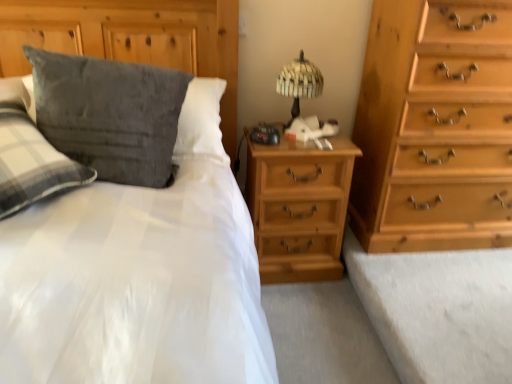
Question: Does suede-like gray pillow at upper left turn towards light brown wood nightstand at center?

Choices:
 (A) no
 (B) yes

Answer: (A)

Question: Is suede-like gray pillow at upper left turned away from light brown wood nightstand at center?

Choices:
 (A) yes
 (B) no

Answer: (B)

Question: Is suede-like gray pillow at upper left at the left side of light brown wood nightstand at center?

Choices:
 (A) yes
 (B) no

Answer: (A)

Question: Considering the relative sizes of suede-like gray pillow at upper left and light brown wood nightstand at center in the image provided, is suede-like gray pillow at upper left thinner than light brown wood nightstand at center?

Choices:
 (A) no
 (B) yes

Answer: (A)

Question: Is light brown wood nightstand at center inside suede-like gray pillow at upper left?

Choices:
 (A) yes
 (B) no

Answer: (B)

Question: Choose the correct answer: Is woven wood table lamp at upper center inside velvety gray pillow at upper left or outside it?

Choices:
 (A) inside
 (B) outside

Answer: (B)

Question: From the image's perspective, is woven wood table lamp at upper center positioned above or below velvety gray pillow at upper left?

Choices:
 (A) above
 (B) below

Answer: (A)

Question: Is woven wood table lamp at upper center in front of or behind velvety gray pillow at upper left in the image?

Choices:
 (A) front
 (B) behind

Answer: (B)

Question: From their relative heights in the image, would you say woven wood table lamp at upper center is taller or shorter than velvety gray pillow at upper left?

Choices:
 (A) tall
 (B) short

Answer: (B)

Question: Relative to light brown wood nightstand at center, is light brown wooden chest of drawers at right in front or behind?

Choices:
 (A) front
 (B) behind

Answer: (A)

Question: Would you say light brown wooden chest of drawers at right is to the left or to the right of light brown wood nightstand at center in the picture?

Choices:
 (A) right
 (B) left

Answer: (A)

Question: From a real-world perspective, is light brown wooden chest of drawers at right above or below light brown wood nightstand at center?

Choices:
 (A) below
 (B) above

Answer: (B)

Question: Is light brown wooden chest of drawers at right spatially inside light brown wood nightstand at center, or outside of it?

Choices:
 (A) outside
 (B) inside

Answer: (A)

Question: In terms of height, does light brown wood nightstand at center look taller or shorter compared to light brown wooden chest of drawers at right?

Choices:
 (A) tall
 (B) short

Answer: (B)

Question: Looking at the image, does light brown wood nightstand at center seem bigger or smaller compared to light brown wooden chest of drawers at right?

Choices:
 (A) small
 (B) big

Answer: (A)